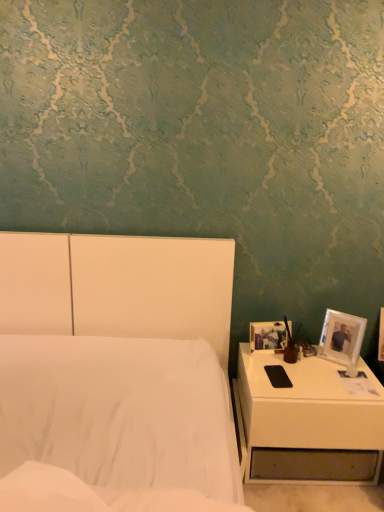
Question: From the image's perspective, is white glossy nightstand at lower right above or below matte brown vase at right?

Choices:
 (A) below
 (B) above

Answer: (A)

Question: In terms of size, does white glossy nightstand at lower right appear bigger or smaller than matte brown vase at right?

Choices:
 (A) big
 (B) small

Answer: (A)

Question: Which is farther from the matte plastic picture frame at right, which is the 2th picture frame from right to left?

Choices:
 (A) matte brown vase at right
 (B) white glossy nightstand at lower right
 (C) white plastic picture frame at right, the first picture frame from the right
 (D) white matte bed at center

Answer: (D)

Question: Which is farther from the white plastic picture frame at right, which is the second picture frame from left to right?

Choices:
 (A) white glossy nightstand at lower right
 (B) matte brown vase at right
 (C) white matte bed at center
 (D) matte plastic picture frame at right, which is the 2th picture frame from right to left

Answer: (C)